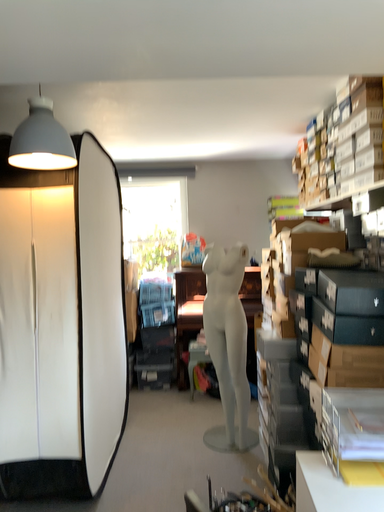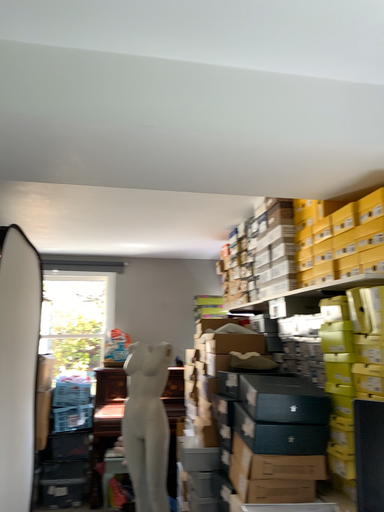
Question: How did the camera likely rotate when shooting the video?

Choices:
 (A) rotated left
 (B) rotated right

Answer: (B)